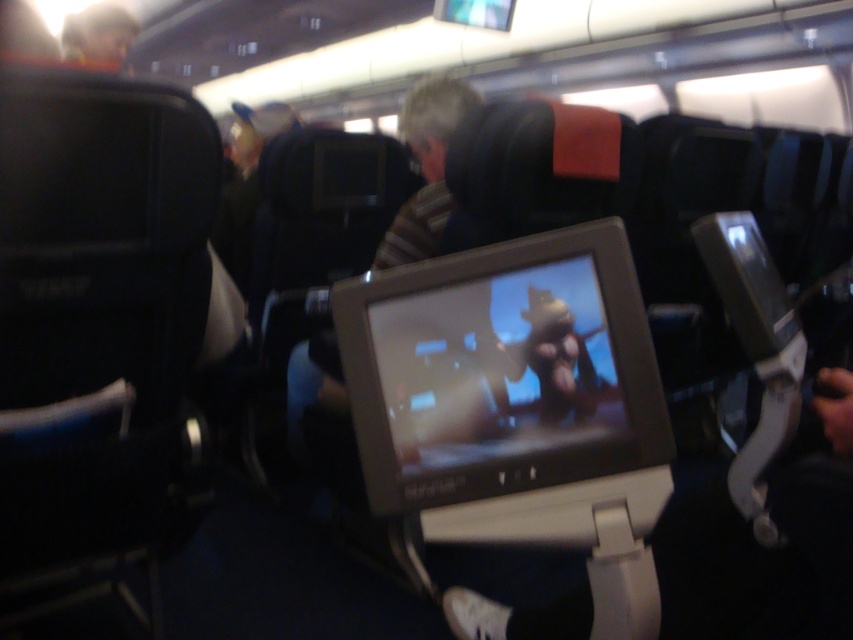
Locate an element on the screen. This screenshot has height=640, width=853. matte plastic screen at center is located at coordinates (497, 368).

Between matte plastic screen at center and smooth plastic toy at upper left, which one appears on the right side from the viewer's perspective?

From the viewer's perspective, matte plastic screen at center appears more on the right side.

Which is in front, point (618, 432) or point (80, 61)?

Point (618, 432)

Find the location of a particular element. The image size is (853, 640). matte plastic screen at center is located at coordinates (497, 368).